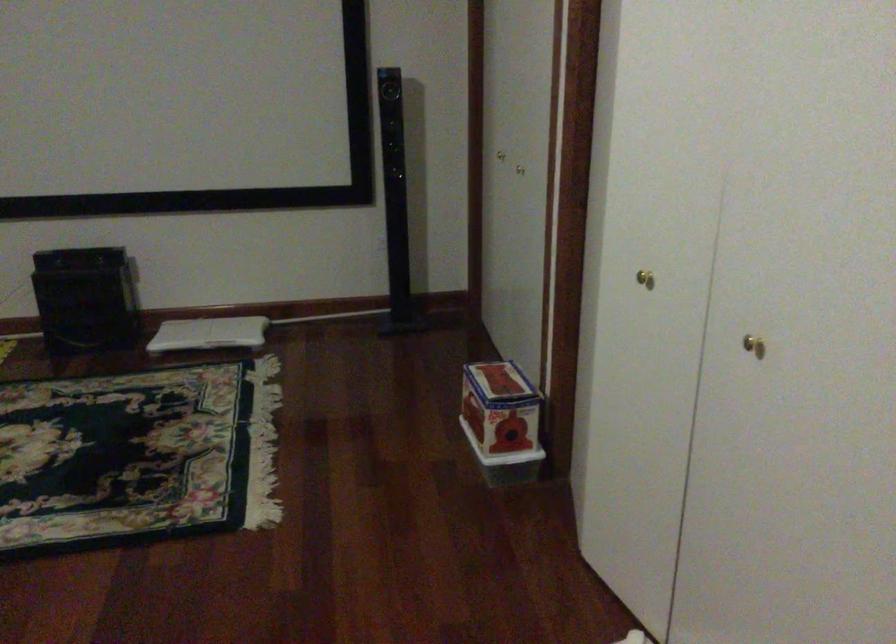
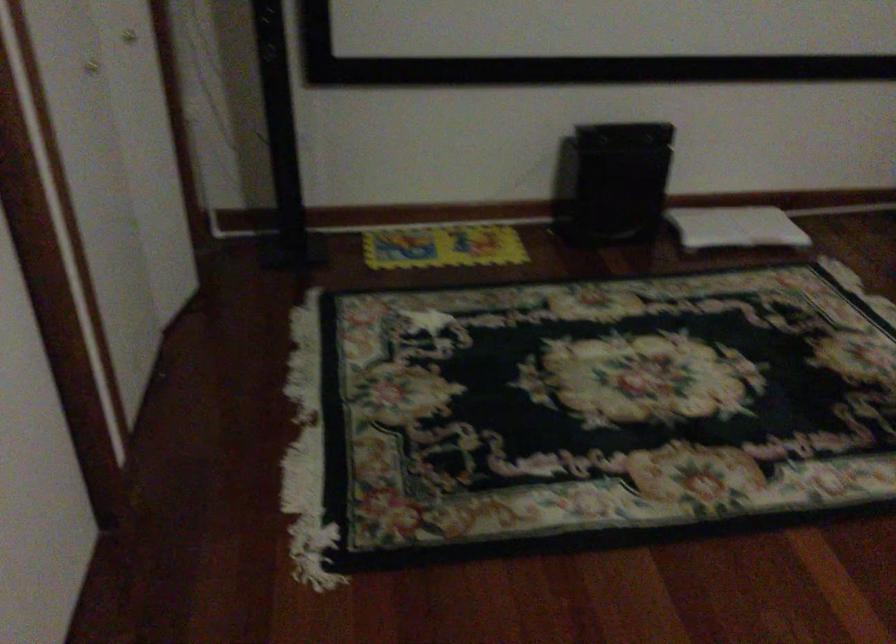
Find the pixel in the second image that matches point 184,335 in the first image.

(735, 227)